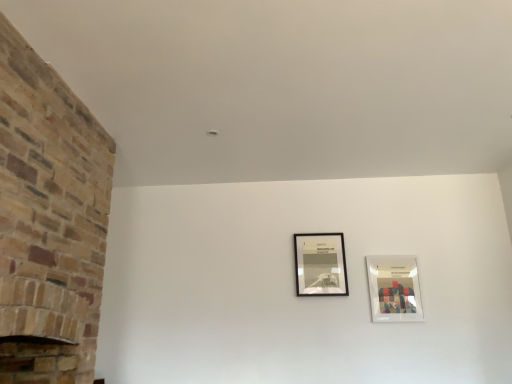
Image resolution: width=512 pixels, height=384 pixels. What do you see at coordinates (394, 288) in the screenshot? I see `white glossy picture frame at upper right, the second picture frame positioned from the left` at bounding box center [394, 288].

This screenshot has height=384, width=512. What are the coordinates of `brick fireplace at left` in the screenshot? It's located at (49, 220).

From a real-world perspective, is brick fireplace at left beneath black matte picture frame at center, the 1th picture frame viewed from the left?

Correct, in the physical world, brick fireplace at left is lower than black matte picture frame at center, the 1th picture frame viewed from the left.

Based on the photo, would you say brick fireplace at left is a long distance from black matte picture frame at center, marked as the second picture frame in a right-to-left arrangement?

Yes, brick fireplace at left and black matte picture frame at center, marked as the second picture frame in a right-to-left arrangement, are quite far apart.

From the picture: Does brick fireplace at left contain black matte picture frame at center, marked as the second picture frame in a right-to-left arrangement?

Actually, black matte picture frame at center, marked as the second picture frame in a right-to-left arrangement, is outside brick fireplace at left.

How far apart are brick fireplace at left and black matte picture frame at center, marked as the second picture frame in a right-to-left arrangement?

brick fireplace at left and black matte picture frame at center, marked as the second picture frame in a right-to-left arrangement, are 6.47 feet apart from each other.

Would you say black matte picture frame at center, the 1th picture frame viewed from the left, contains white glossy picture frame at upper right, the second picture frame positioned from the left?

No.

Is black matte picture frame at center, marked as the second picture frame in a right-to-left arrangement, not near white glossy picture frame at upper right, the second picture frame positioned from the left?

→ No, black matte picture frame at center, marked as the second picture frame in a right-to-left arrangement, is not far away from white glossy picture frame at upper right, the second picture frame positioned from the left.

You are a GUI agent. You are given a task and a screenshot of the screen. Output one action in this format:
    pyautogui.click(x=<x>, y=<y>)
    Task: Click on the picture frame above the white glossy picture frame at upper right, the second picture frame positioned from the left (from a real-world perspective)
    This screenshot has height=384, width=512.
    Given the screenshot: What is the action you would take?
    pyautogui.click(x=320, y=264)

From a real-world perspective, is black matte picture frame at center, the 1th picture frame viewed from the left, under white glossy picture frame at upper right, marked as the first picture frame in a right-to-left arrangement?

No, from a real-world perspective, black matte picture frame at center, the 1th picture frame viewed from the left, is not below white glossy picture frame at upper right, marked as the first picture frame in a right-to-left arrangement.

Consider the image. Considering the relative sizes of brick fireplace at left and white glossy picture frame at upper right, marked as the first picture frame in a right-to-left arrangement, in the image provided, is brick fireplace at left wider than white glossy picture frame at upper right, marked as the first picture frame in a right-to-left arrangement,?

Yes.

Who is bigger, brick fireplace at left or white glossy picture frame at upper right, marked as the first picture frame in a right-to-left arrangement?

brick fireplace at left is bigger.

Is brick fireplace at left further to the viewer compared to white glossy picture frame at upper right, marked as the first picture frame in a right-to-left arrangement?

No, it is not.

Are brick fireplace at left and white glossy picture frame at upper right, the second picture frame positioned from the left, making contact?

No.

Is brick fireplace at left at the back of white glossy picture frame at upper right, the second picture frame positioned from the left?

No, brick fireplace at left is not at the back of white glossy picture frame at upper right, the second picture frame positioned from the left.

Is point (413, 276) positioned after point (61, 80)?

Yes.

How different are the orientations of white glossy picture frame at upper right, marked as the first picture frame in a right-to-left arrangement, and brick fireplace at left in degrees?

89.1 degrees separate the facing orientations of white glossy picture frame at upper right, marked as the first picture frame in a right-to-left arrangement, and brick fireplace at left.

Based on the photo, from their relative heights in the image, would you say white glossy picture frame at upper right, the second picture frame positioned from the left, is taller or shorter than brick fireplace at left?

In the image, white glossy picture frame at upper right, the second picture frame positioned from the left, appears to be shorter than brick fireplace at left.

Is black matte picture frame at center, marked as the second picture frame in a right-to-left arrangement, oriented away from brick fireplace at left?

black matte picture frame at center, marked as the second picture frame in a right-to-left arrangement, does not have its back to brick fireplace at left.

Locate an element on the screen. The image size is (512, 384). the 1st picture frame to the right of the brick fireplace at left, starting your count from the anchor is located at coordinates (320, 264).

Considering the relative sizes of black matte picture frame at center, marked as the second picture frame in a right-to-left arrangement, and brick fireplace at left in the image provided, is black matte picture frame at center, marked as the second picture frame in a right-to-left arrangement, wider than brick fireplace at left?

No.

Can you tell me how much white glossy picture frame at upper right, the second picture frame positioned from the left, and black matte picture frame at center, marked as the second picture frame in a right-to-left arrangement, differ in facing direction?

The facing directions of white glossy picture frame at upper right, the second picture frame positioned from the left, and black matte picture frame at center, marked as the second picture frame in a right-to-left arrangement, are 0.109 degrees apart.

The width and height of the screenshot is (512, 384). In order to click on picture frame above the white glossy picture frame at upper right, the second picture frame positioned from the left (from a real-world perspective) in this screenshot , I will do `click(320, 264)`.

Is white glossy picture frame at upper right, marked as the first picture frame in a right-to-left arrangement, closer to camera compared to black matte picture frame at center, marked as the second picture frame in a right-to-left arrangement?

Yes.

From the picture: How much distance is there between white glossy picture frame at upper right, marked as the first picture frame in a right-to-left arrangement, and black matte picture frame at center, marked as the second picture frame in a right-to-left arrangement?

white glossy picture frame at upper right, marked as the first picture frame in a right-to-left arrangement, is 41.48 centimeters away from black matte picture frame at center, marked as the second picture frame in a right-to-left arrangement.

I want to click on picture frame above the brick fireplace at left (from a real-world perspective), so click(x=320, y=264).

This screenshot has height=384, width=512. In order to click on picture frame in front of the black matte picture frame at center, the 1th picture frame viewed from the left in this screenshot , I will do [394, 288].

When comparing their distances from white glossy picture frame at upper right, the second picture frame positioned from the left, does black matte picture frame at center, the 1th picture frame viewed from the left, or brick fireplace at left seem closer?

black matte picture frame at center, the 1th picture frame viewed from the left.

Considering their positions, is brick fireplace at left positioned further to black matte picture frame at center, marked as the second picture frame in a right-to-left arrangement, than white glossy picture frame at upper right, the second picture frame positioned from the left?

The object further to black matte picture frame at center, marked as the second picture frame in a right-to-left arrangement, is brick fireplace at left.

Consider the image. From the image, which object appears to be farther from black matte picture frame at center, marked as the second picture frame in a right-to-left arrangement, white glossy picture frame at upper right, the second picture frame positioned from the left, or brick fireplace at left?

The object further to black matte picture frame at center, marked as the second picture frame in a right-to-left arrangement, is brick fireplace at left.

Looking at the image, which one is located closer to brick fireplace at left, white glossy picture frame at upper right, marked as the first picture frame in a right-to-left arrangement, or black matte picture frame at center, marked as the second picture frame in a right-to-left arrangement?

The object closer to brick fireplace at left is black matte picture frame at center, marked as the second picture frame in a right-to-left arrangement.

From the picture: From the image, which object appears to be farther from white glossy picture frame at upper right, marked as the first picture frame in a right-to-left arrangement, brick fireplace at left or black matte picture frame at center, the 1th picture frame viewed from the left?

Based on the image, brick fireplace at left appears to be further to white glossy picture frame at upper right, marked as the first picture frame in a right-to-left arrangement.

Based on the photo, from the image, which object appears to be nearer to brick fireplace at left, black matte picture frame at center, marked as the second picture frame in a right-to-left arrangement, or white glossy picture frame at upper right, the second picture frame positioned from the left?

black matte picture frame at center, marked as the second picture frame in a right-to-left arrangement, is positioned closer to the anchor brick fireplace at left.

Locate an element on the screen. The height and width of the screenshot is (384, 512). picture frame positioned between brick fireplace at left and black matte picture frame at center, marked as the second picture frame in a right-to-left arrangement, from near to far is located at coordinates (394, 288).